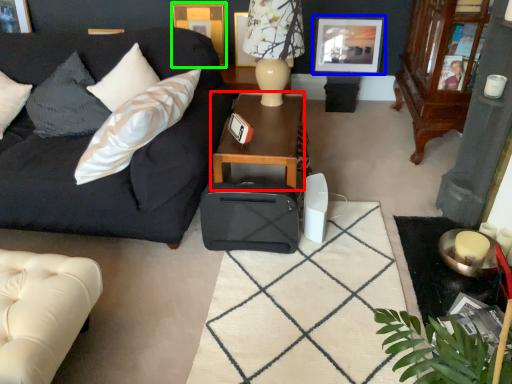
Question: Which is farther away from table (highlighted by a red box)? picture frame (highlighted by a blue box) or picture frame (highlighted by a green box)?

Choices:
 (A) picture frame
 (B) picture frame

Answer: (B)